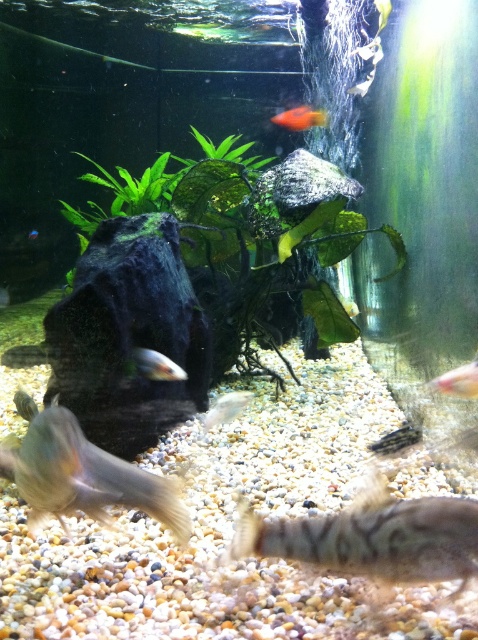
Question: Can you confirm if matte silver fish at center is bigger than translucent glass fish at center?

Choices:
 (A) no
 (B) yes

Answer: (A)

Question: Considering the real-world distances, which object is farthest from the translucent yellow fish at upper right?

Choices:
 (A) translucent glass fish at center
 (B) translucent plastic fish at center
 (C) translucent yellowish fish at bottom left

Answer: (C)

Question: Which point is farther from the camera taking this photo?

Choices:
 (A) (280, 116)
 (B) (9, 352)

Answer: (A)

Question: Is translucent pinkish fish at right bigger than matte silver fish at center?

Choices:
 (A) no
 (B) yes

Answer: (A)

Question: Which point appears farthest from the camera in this image?

Choices:
 (A) (380, 19)
 (B) (293, 113)
 (C) (311, 176)

Answer: (B)

Question: Does brown textured fish at bottom appear over orange glossy fish at upper center?

Choices:
 (A) yes
 (B) no

Answer: (B)